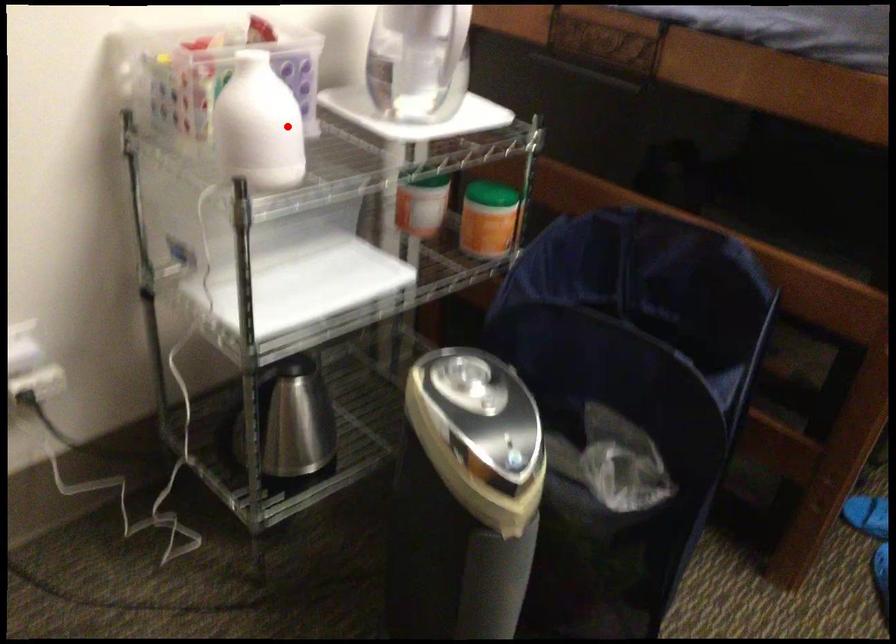
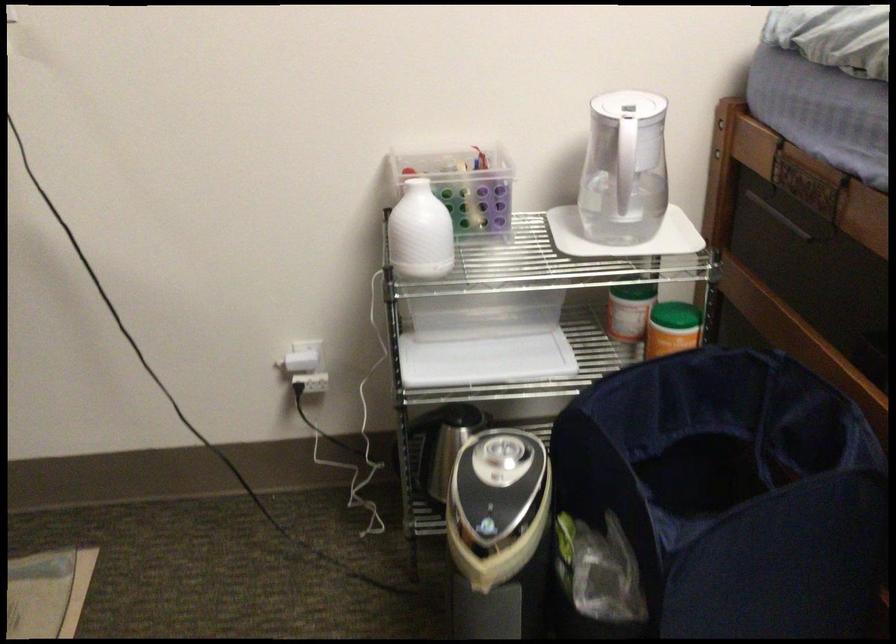
The point at the highlighted location is marked in the first image. Where is the corresponding point in the second image?

(419, 232)